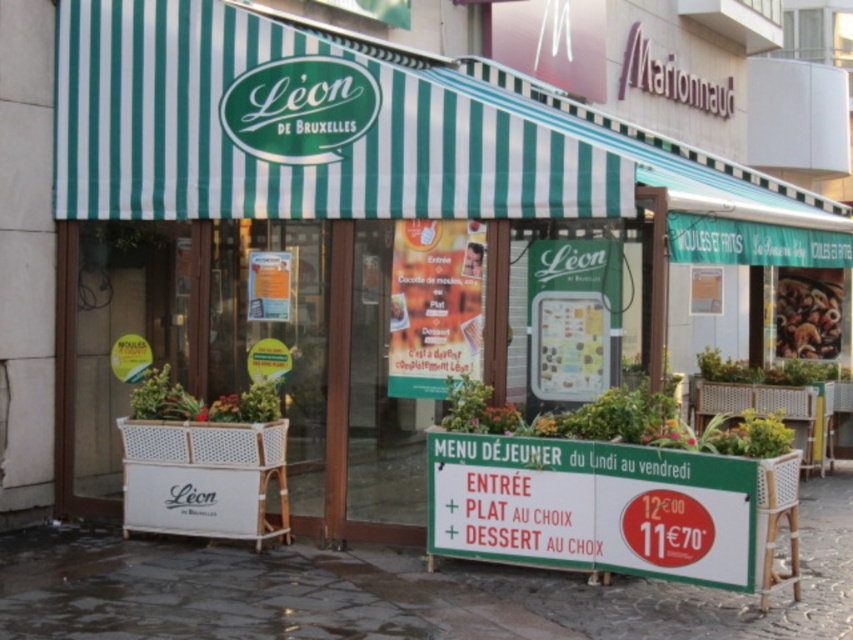
You are a customer standing outside the L?on de Bruxelles cafe. You want to check both the green striped awning at upper center and the green plastic sign at center. Which object is taller?

The green striped awning at upper center is much taller than the green plastic sign at center.

You are a painter who wants to paint the green striped awning at upper center and dark gray stone pavement at lower center. Which one should you paint first if you want to paint the wider object first?

The green striped awning at upper center is wider than the dark gray stone pavement at lower center, so you should paint the green striped awning at upper center first.